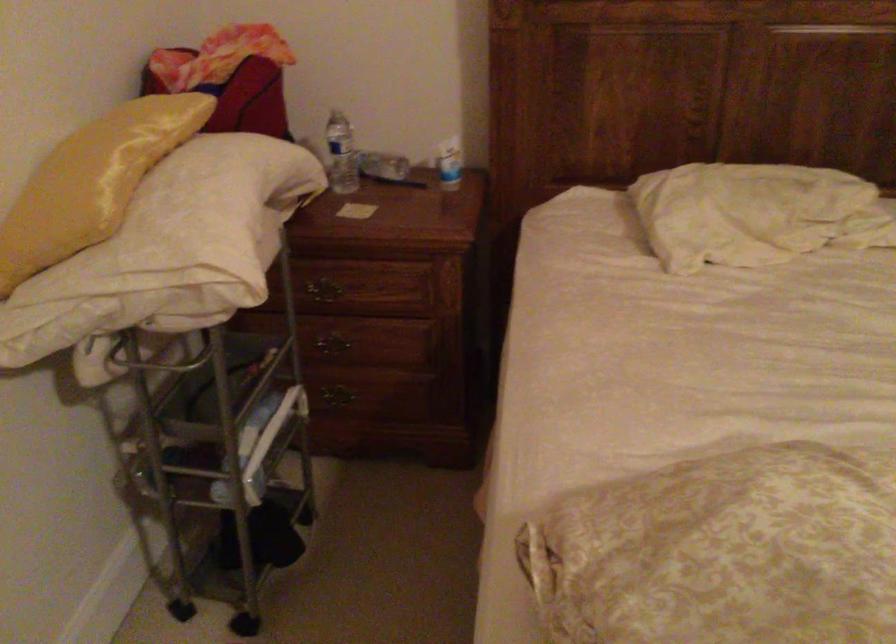
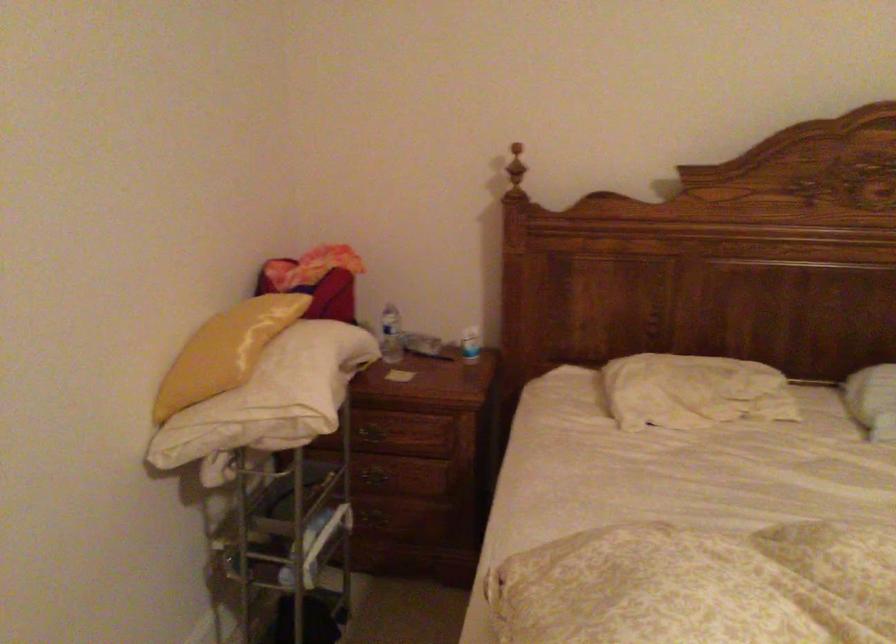
The point at (184, 216) is marked in the first image. Where is the corresponding point in the second image?

(287, 375)